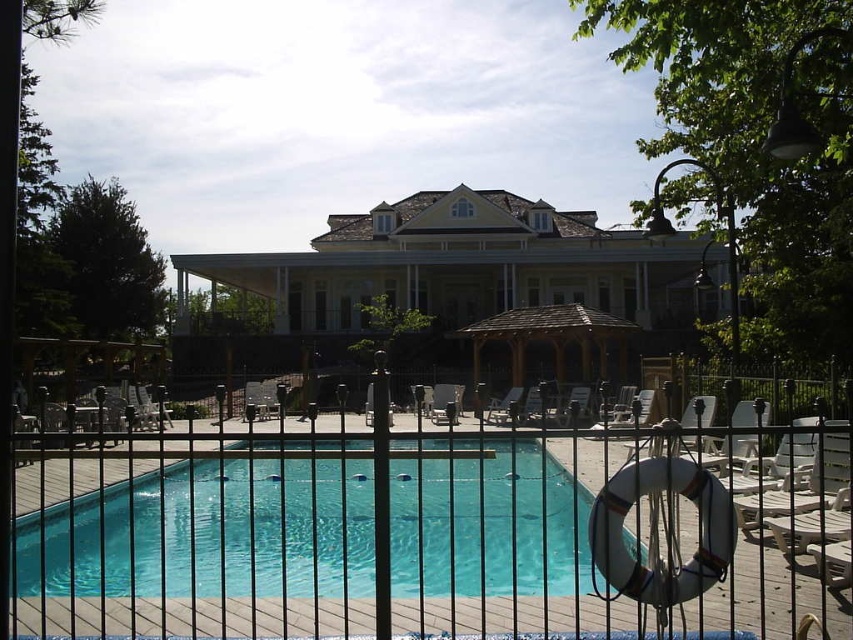
Question: Can you confirm if brown wooden gazebo at center is positioned below wooden lounge chair at center?

Choices:
 (A) yes
 (B) no

Answer: (B)

Question: In this image, where is black metal fence at center located relative to brown wooden gazebo at center?

Choices:
 (A) right
 (B) left

Answer: (B)

Question: Which object appears farthest from the camera in this image?

Choices:
 (A) black metal fence at center
 (B) brown wooden gazebo at center
 (C) clear glass pool at center
 (D) wooden lounge chair at center

Answer: (B)

Question: Which point is closer to the camera taking this photo?

Choices:
 (A) (544, 326)
 (B) (448, 499)
 (C) (436, 397)
 (D) (573, 538)

Answer: (D)

Question: Among these objects, which one is farthest from the camera?

Choices:
 (A) brown wooden gazebo at center
 (B) clear glass pool at center
 (C) wooden lounge chair at center
 (D) black metal fence at center

Answer: (A)

Question: Can you confirm if black metal fence at center is positioned to the right of clear glass pool at center?

Choices:
 (A) yes
 (B) no

Answer: (A)